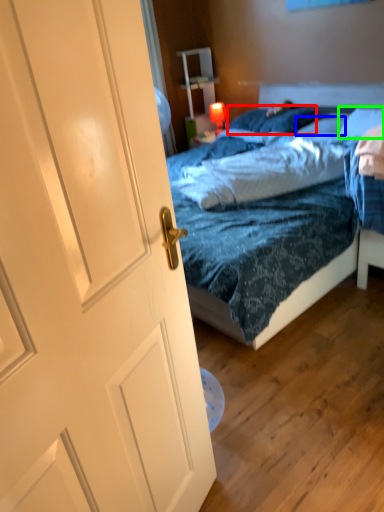
Question: Which is farther away from pillow (highlighted by a red box)? pillow (highlighted by a blue box) or pillow (highlighted by a green box)?

Choices:
 (A) pillow
 (B) pillow

Answer: (B)